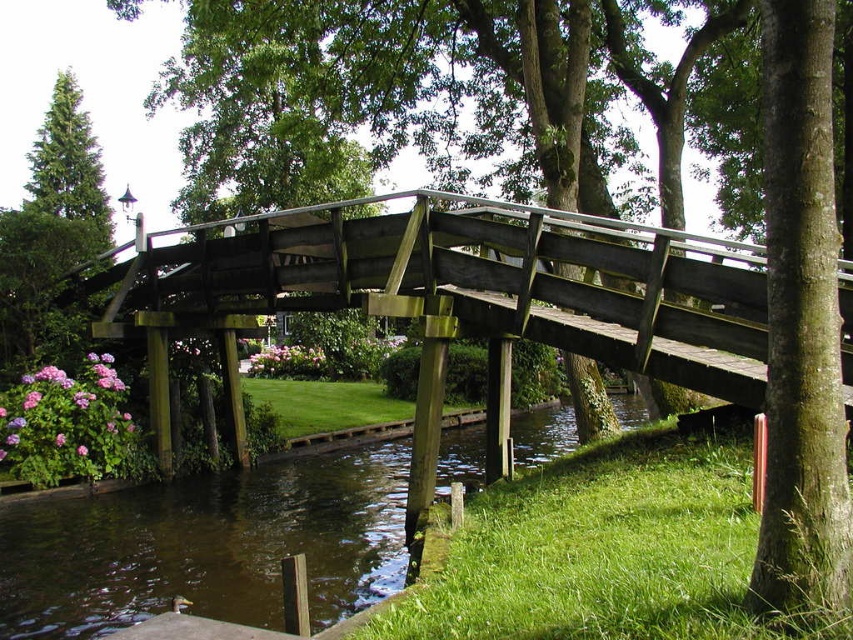
Question: Is wooden bridge at center above brown wooden river at lower left?

Choices:
 (A) yes
 (B) no

Answer: (A)

Question: Which is farther from the green matte tree at upper left?

Choices:
 (A) smooth brown tree trunk at right
 (B) brown wooden river at lower left
 (C) wooden bridge at center

Answer: (A)

Question: Considering the real-world distances, which object is closest to the brown wooden river at lower left?

Choices:
 (A) smooth brown tree trunk at right
 (B) green matte tree at upper left
 (C) wooden bridge at center

Answer: (C)

Question: Does brown wooden river at lower left appear over green matte tree at upper left?

Choices:
 (A) yes
 (B) no

Answer: (B)

Question: Is brown wooden river at lower left below green matte tree at upper left?

Choices:
 (A) no
 (B) yes

Answer: (B)

Question: Which object appears closest to the camera in this image?

Choices:
 (A) smooth brown tree trunk at right
 (B) green matte tree at upper left

Answer: (A)